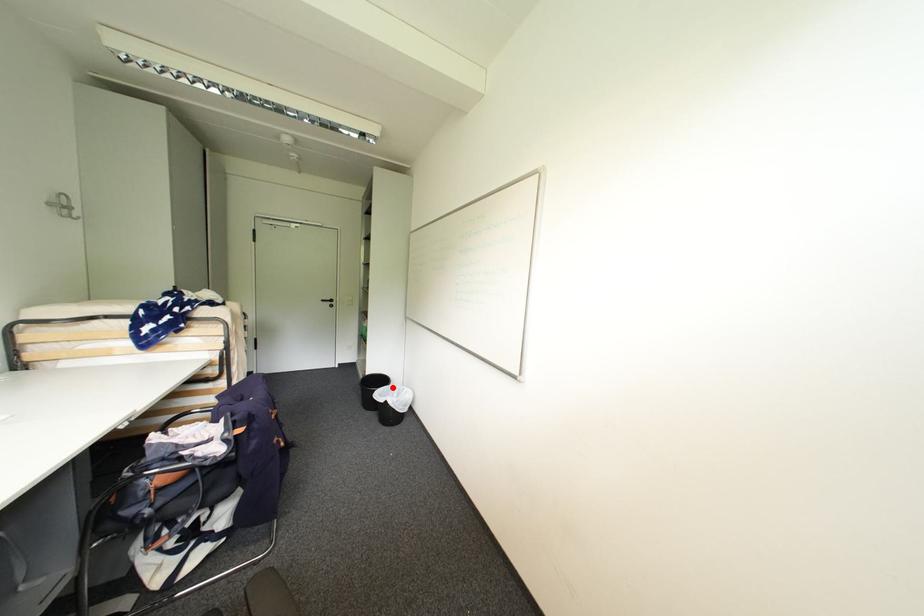
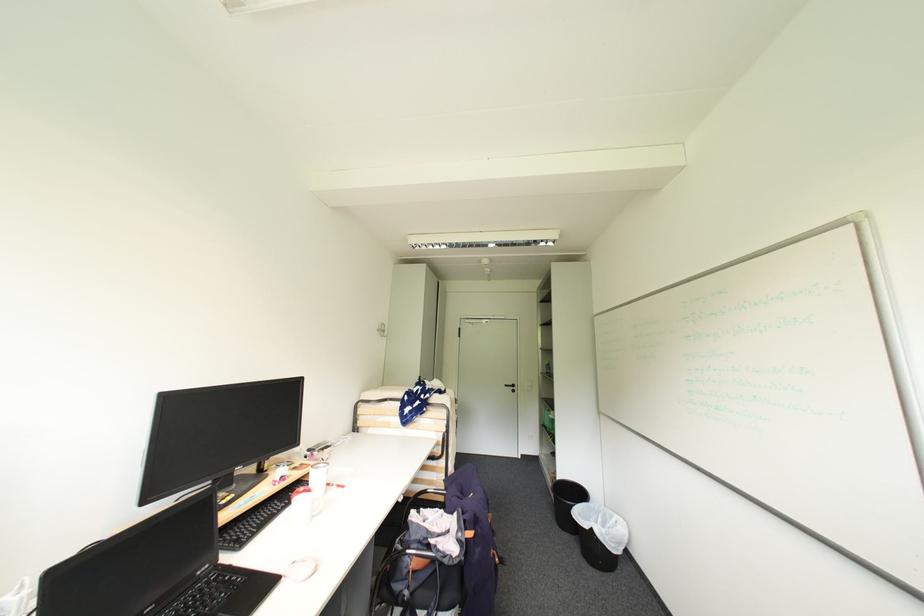
Where in the second image is the point corresponding to the highlighted location from the first image?

(591, 505)